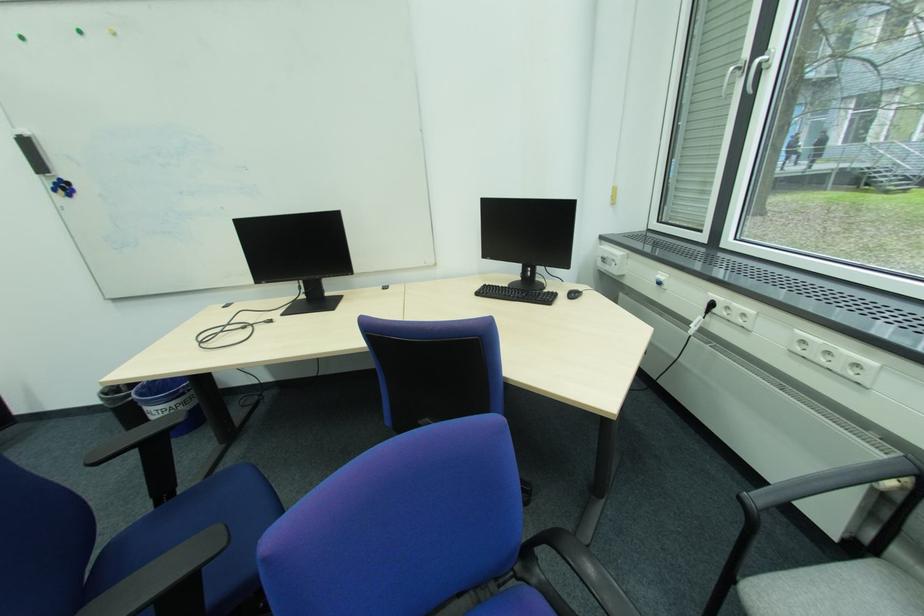
Where would you lift the blue paper bin? Please return your answer as a coordinate pair (x, y).

(169, 402)